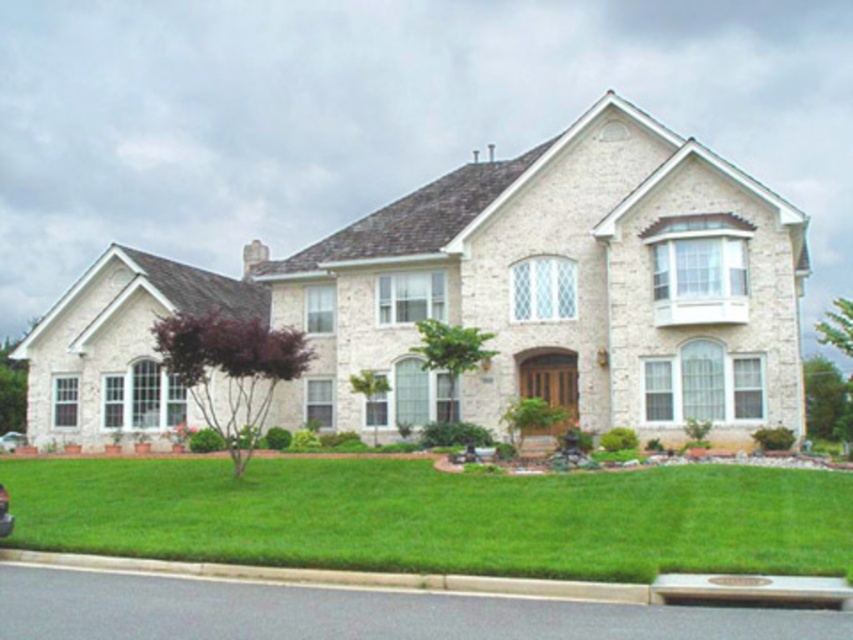
You are a gardener who wants to plant a new flower bed between the green grass at lower center and the gray concrete curb at lower center. Which object should you start modifying first if you want the flower bed to be level with the ground?

The green grass at lower center has a greater height compared to the gray concrete curb at lower center. Therefore, you should start modifying the gray concrete curb at lower center to match the height of the green grass at lower center to ensure the flower bed is level with the ground.

You are standing at the front door of the house and want to walk to the shiny black car at lower left. Which direction should you walk to avoid stepping on the green grass at lower center?

The green grass at lower center is above the shiny black car at lower left, so you should walk to the left or right of the car to avoid stepping on the grass.

You are standing at the front door of the house and want to place a decorative pot at the point marked as point (488, 580). Based on the scene description, where exactly is this point located?

The point (488, 580) is on the gray concrete curb at lower center, so you should place the decorative pot on the gray concrete curb located at the lower central part of the scene.